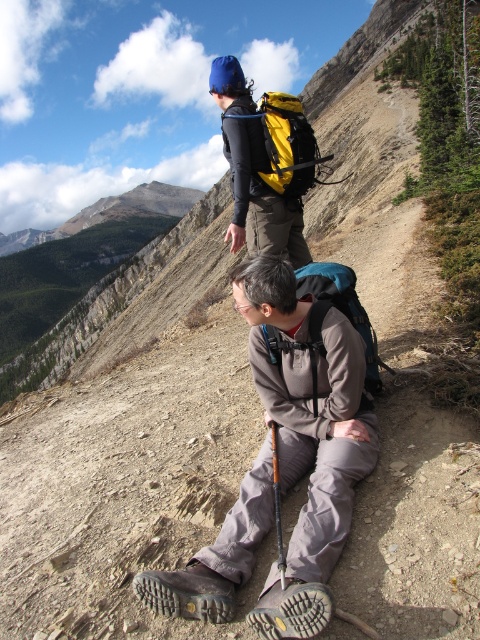
Which is below, gray fabric backpack at center or teal fabric backpack at center?

gray fabric backpack at center is below.

Is point (273, 417) more distant than point (303, 348)?

That is True.

This screenshot has width=480, height=640. I want to click on gray fabric backpack at center, so click(x=307, y=433).

Is teal fabric backpack at center above yellow fabric backpack at upper center?

Actually, teal fabric backpack at center is below yellow fabric backpack at upper center.

Based on the photo, can you confirm if teal fabric backpack at center is thinner than yellow fabric backpack at upper center?

Indeed, teal fabric backpack at center has a lesser width compared to yellow fabric backpack at upper center.

Does point (312, 392) come behind point (259, 172)?

No, it is not.

Locate an element on the screen. The image size is (480, 640). teal fabric backpack at center is located at coordinates (343, 314).

Can you confirm if gray fabric backpack at center is thinner than yellow fabric backpack at upper center?

Correct, gray fabric backpack at center's width is less than yellow fabric backpack at upper center's.

Who is lower down, gray fabric backpack at center or yellow fabric backpack at upper center?

gray fabric backpack at center is below.

Locate an element on the screen. gray fabric backpack at center is located at coordinates (307, 433).